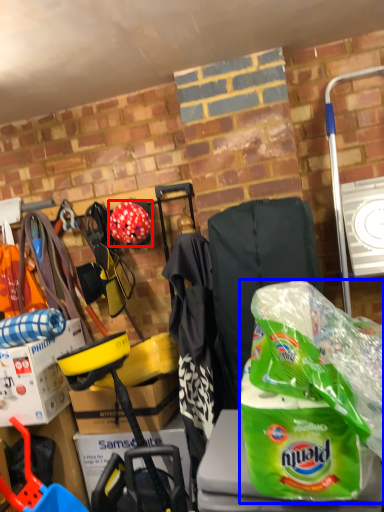
Question: Which point is further to the camera, helmet (highlighted by a red box) or plastic bag (highlighted by a blue box)?

Choices:
 (A) helmet
 (B) plastic bag

Answer: (A)